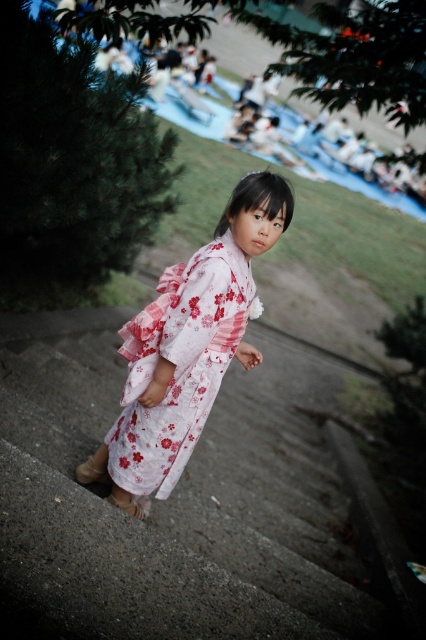
Question: Which object is closer to the camera taking this photo?

Choices:
 (A) concrete stairs at center
 (B) white floral kimono at center

Answer: (B)

Question: Is concrete stairs at center behind white floral kimono at center?

Choices:
 (A) yes
 (B) no

Answer: (A)

Question: Can you confirm if concrete stairs at center is wider than white floral kimono at center?

Choices:
 (A) no
 (B) yes

Answer: (B)

Question: Does concrete stairs at center have a smaller size compared to white floral kimono at center?

Choices:
 (A) no
 (B) yes

Answer: (A)